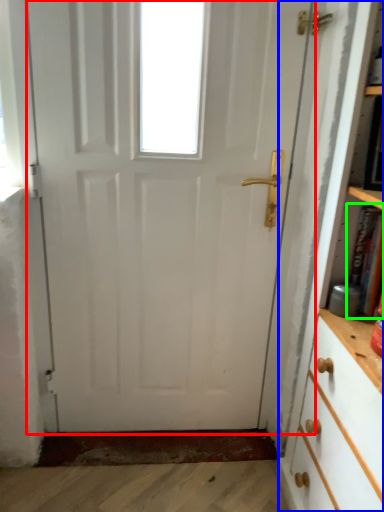
Question: Which object is positioned farthest from door (highlighted by a red box)? Select from bookcase (highlighted by a blue box) and book (highlighted by a green box).

Choices:
 (A) bookcase
 (B) book

Answer: (B)